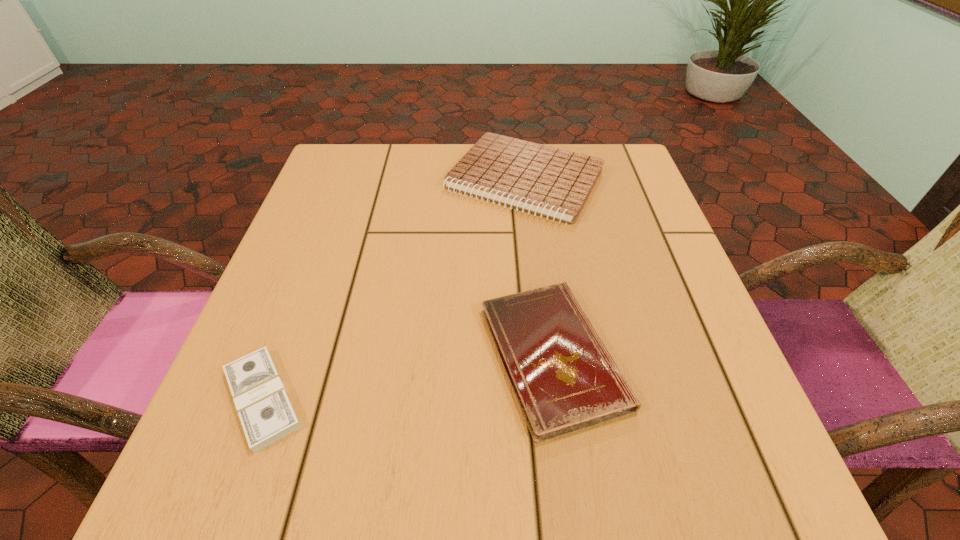
You are a GUI agent. You are given a task and a screenshot of the screen. Output one action in this format:
    pyautogui.click(x=<x>, y=<y>)
    Task: Click on the vacant space at the near left corner
    
    Given the screenshot: What is the action you would take?
    pyautogui.click(x=231, y=473)

What are the coordinates of `vacant region at the far right corner` in the screenshot? It's located at (625, 181).

Identify the location of free space at the near right corner of the desktop. The width and height of the screenshot is (960, 540). (734, 471).

Image resolution: width=960 pixels, height=540 pixels. I want to click on free spot between the nearer notebook and the shortest object, so click(407, 377).

Locate an element on the screen. The height and width of the screenshot is (540, 960). empty location between the shortest object and the farthest object is located at coordinates (394, 289).

You are a GUI agent. You are given a task and a screenshot of the screen. Output one action in this format:
    pyautogui.click(x=<x>, y=<y>)
    Task: Click on the free area in between the farthest object and the dollar
    The height and width of the screenshot is (540, 960).
    Given the screenshot: What is the action you would take?
    pyautogui.click(x=394, y=289)

Where is `vacant region between the shortest object and the shorter notebook`? This screenshot has height=540, width=960. vacant region between the shortest object and the shorter notebook is located at coordinates (407, 377).

Where is `blank region between the dollar and the second shortest object`? blank region between the dollar and the second shortest object is located at coordinates (407, 377).

You are a GUI agent. You are given a task and a screenshot of the screen. Output one action in this format:
    pyautogui.click(x=<x>, y=<y>)
    Task: Click on the vacant space that's between the nearer notebook and the shortest object
    The width and height of the screenshot is (960, 540).
    Given the screenshot: What is the action you would take?
    pyautogui.click(x=407, y=377)

I want to click on unoccupied position between the taller notebook and the shorter notebook, so click(539, 268).